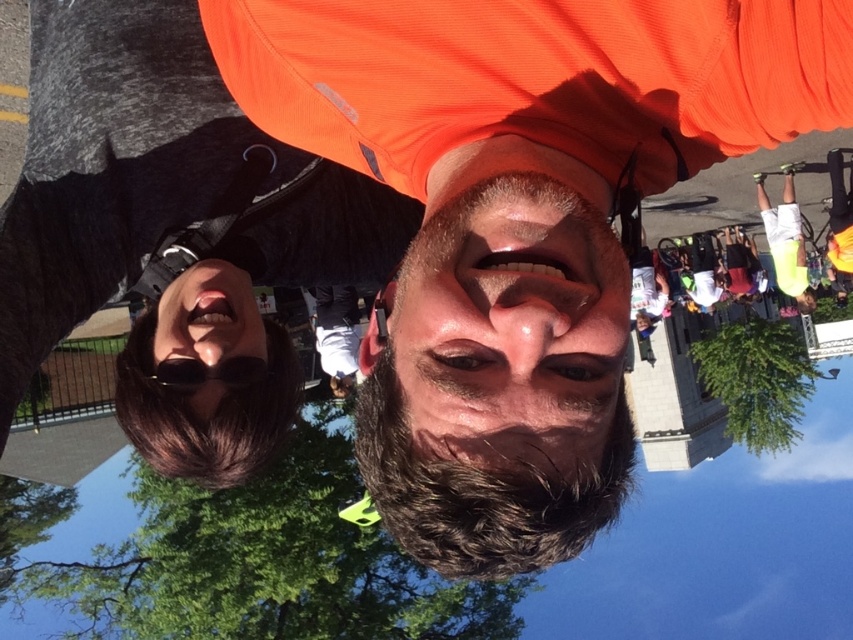
Question: Which object appears closest to the camera in this image?

Choices:
 (A) black matte sunglasses at lower left
 (B) brown matte beard at center
 (C) brown hair at lower left
 (D) sunglasses at lower left

Answer: (B)

Question: Observing the image, what is the correct spatial positioning of brown matte beard at center in reference to sunglasses at lower left?

Choices:
 (A) right
 (B) left

Answer: (A)

Question: Is sunglasses at lower left smaller than black matte sunglasses at lower left?

Choices:
 (A) no
 (B) yes

Answer: (A)

Question: Which object is the closest to the black matte sunglasses at lower left?

Choices:
 (A) brown matte beard at center
 (B) brown hair at lower left
 (C) sunglasses at lower left

Answer: (C)

Question: Can you confirm if brown hair at lower left is smaller than sunglasses at lower left?

Choices:
 (A) yes
 (B) no

Answer: (B)

Question: Among these objects, which one is farthest from the camera?

Choices:
 (A) brown hair at lower left
 (B) brown matte beard at center
 (C) black matte sunglasses at lower left

Answer: (C)